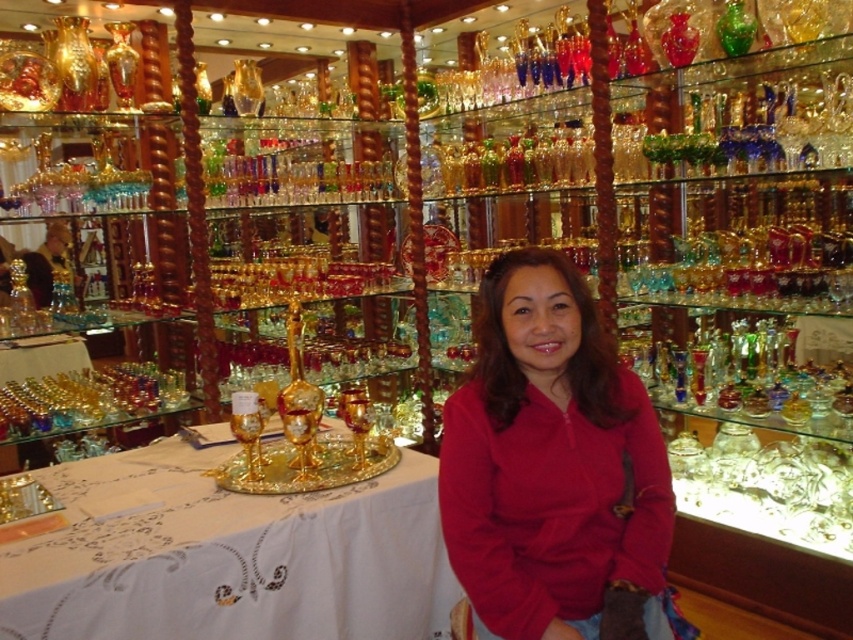
Question: Which point is closer to the camera?

Choices:
 (A) (221, 568)
 (B) (532, 522)

Answer: (B)

Question: Can you confirm if white embroidered tablecloth at center is smaller than matte red sweater at center?

Choices:
 (A) yes
 (B) no

Answer: (B)

Question: Does white embroidered tablecloth at center appear under matte red sweater at center?

Choices:
 (A) no
 (B) yes

Answer: (B)

Question: Is white embroidered tablecloth at center below matte red sweater at center?

Choices:
 (A) no
 (B) yes

Answer: (B)

Question: Which of the following is the farthest from the observer?

Choices:
 (A) matte red sweater at center
 (B) white embroidered tablecloth at center

Answer: (A)